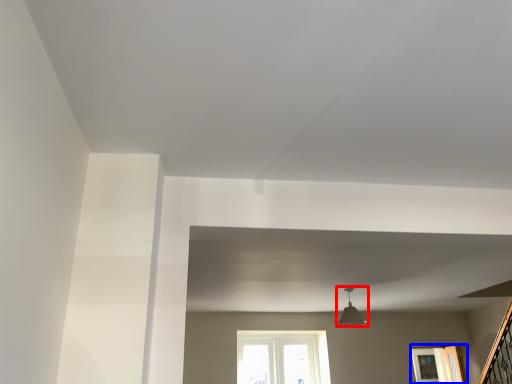
Question: Which point is closer to the camera, light fixture (highlighted by a red box) or window (highlighted by a blue box)?

Choices:
 (A) light fixture
 (B) window

Answer: (A)